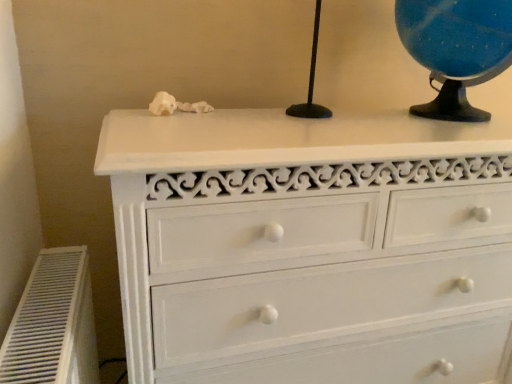
Question: From a real-world perspective, relative to white plastic air conditioner at lower left, is white painted wood chest of drawers at upper center vertically above or below?

Choices:
 (A) above
 (B) below

Answer: (A)

Question: From the image's perspective, is white painted wood chest of drawers at upper center positioned above or below white plastic air conditioner at lower left?

Choices:
 (A) below
 (B) above

Answer: (B)

Question: Which of these objects is positioned closest to the white plastic air conditioner at lower left?

Choices:
 (A) white painted wood chest of drawers at upper center
 (B) matte black globe at upper right

Answer: (A)

Question: Which of these objects is positioned farthest from the white plastic air conditioner at lower left?

Choices:
 (A) matte black globe at upper right
 (B) white painted wood chest of drawers at upper center

Answer: (A)